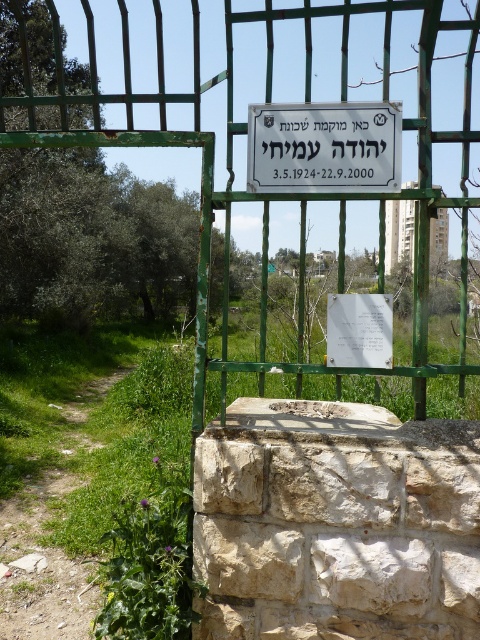
Does white plastic sign at center appear under white paper at center?

Incorrect, white plastic sign at center is not positioned below white paper at center.

Who is more distant from viewer, (289, 132) or (363, 340)?

Point (289, 132)

You are a GUI agent. You are given a task and a screenshot of the screen. Output one action in this format:
    pyautogui.click(x=<x>, y=<y>)
    Task: Click on the white plastic sign at center
    The width and height of the screenshot is (480, 640).
    Given the screenshot: What is the action you would take?
    pyautogui.click(x=324, y=147)

Based on the photo, which is more to the right, green metal gate at center or white plastic sign at center?

Positioned to the right is white plastic sign at center.

Which is in front, point (31, 147) or point (336, 188)?

Point (336, 188) is more forward.

Where is `green metal gate at center`? This screenshot has height=640, width=480. green metal gate at center is located at coordinates (269, 189).

Which of these two, green metal gate at center or white paper at center, stands taller?

green metal gate at center is taller.

How much distance is there between green metal gate at center and white paper at center?

green metal gate at center and white paper at center are 3.47 feet apart from each other.

Does point (430, 77) come closer to viewer compared to point (389, 336)?

No, it is not.

Locate an element on the screen. The height and width of the screenshot is (640, 480). green metal gate at center is located at coordinates (269, 189).